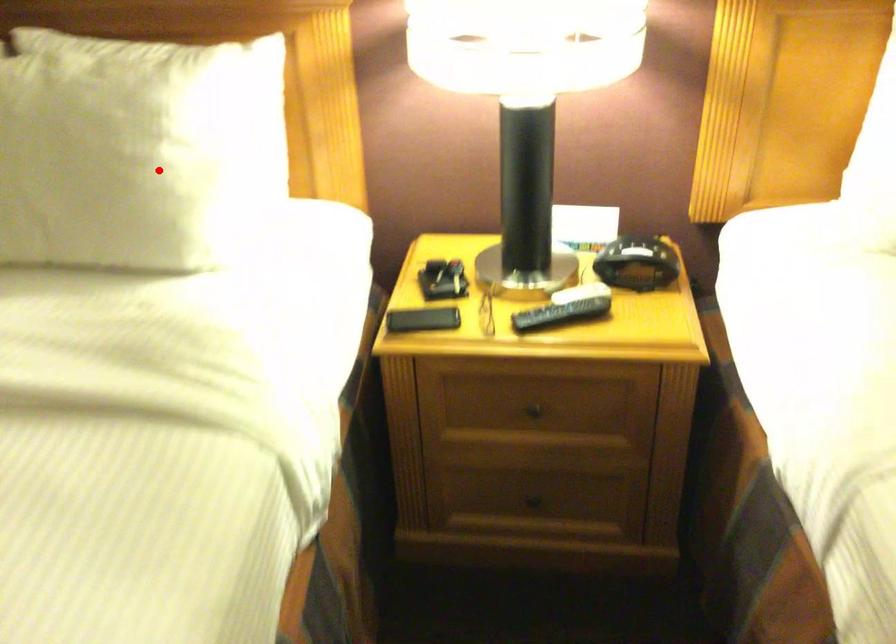
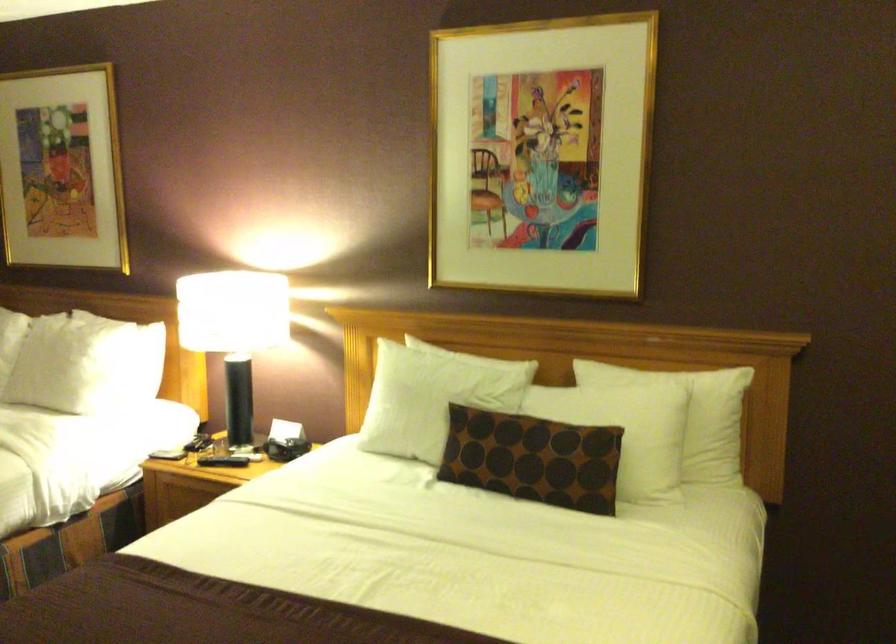
Locate, in the second image, the point that corresponds to the highlighted location in the first image.

(73, 364)